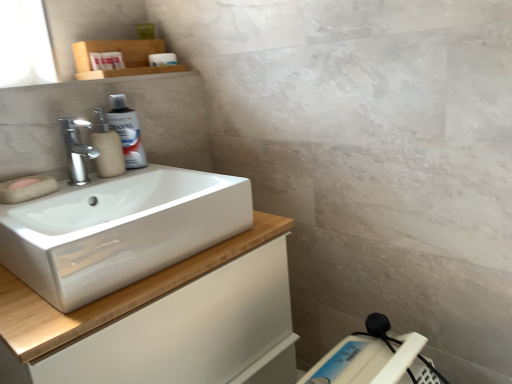
Question: Is white glossy cabinet at lower left thinner than white plastic scale at lower right?

Choices:
 (A) no
 (B) yes

Answer: (A)

Question: Could you tell me if white glossy cabinet at lower left is facing white plastic scale at lower right?

Choices:
 (A) yes
 (B) no

Answer: (A)

Question: From the image's perspective, is white glossy cabinet at lower left over white plastic scale at lower right?

Choices:
 (A) no
 (B) yes

Answer: (A)

Question: Is white glossy cabinet at lower left shorter than white plastic scale at lower right?

Choices:
 (A) yes
 (B) no

Answer: (B)

Question: Considering the relative positions of white glossy cabinet at lower left and white plastic scale at lower right in the image provided, is white glossy cabinet at lower left to the right of white plastic scale at lower right from the viewer's perspective?

Choices:
 (A) yes
 (B) no

Answer: (B)

Question: From a real-world perspective, is beige matte soap dispenser at left positioned above or below pink sponge at left?

Choices:
 (A) below
 (B) above

Answer: (B)

Question: Is point (117, 140) closer or farther from the camera than point (13, 185)?

Choices:
 (A) closer
 (B) farther

Answer: (B)

Question: In terms of width, does beige matte soap dispenser at left look wider or thinner when compared to pink sponge at left?

Choices:
 (A) wide
 (B) thin

Answer: (A)

Question: Based on their sizes in the image, would you say beige matte soap dispenser at left is bigger or smaller than pink sponge at left?

Choices:
 (A) small
 (B) big

Answer: (B)

Question: From their relative heights in the image, would you say white glossy sink at left is taller or shorter than silver metallic spray can at upper left?

Choices:
 (A) tall
 (B) short

Answer: (A)

Question: Considering the positions of white glossy sink at left and silver metallic spray can at upper left in the image, is white glossy sink at left bigger or smaller than silver metallic spray can at upper left?

Choices:
 (A) small
 (B) big

Answer: (B)

Question: From a real-world perspective, is white glossy sink at left above or below silver metallic spray can at upper left?

Choices:
 (A) below
 (B) above

Answer: (A)

Question: Relative to silver metallic spray can at upper left, is white glossy sink at left in front or behind?

Choices:
 (A) behind
 (B) front

Answer: (B)

Question: From a real-world perspective, is white plastic scale at lower right physically located above or below beige matte soap dispenser at left?

Choices:
 (A) below
 (B) above

Answer: (A)

Question: Considering the positions of white plastic scale at lower right and beige matte soap dispenser at left in the image, is white plastic scale at lower right taller or shorter than beige matte soap dispenser at left?

Choices:
 (A) short
 (B) tall

Answer: (B)